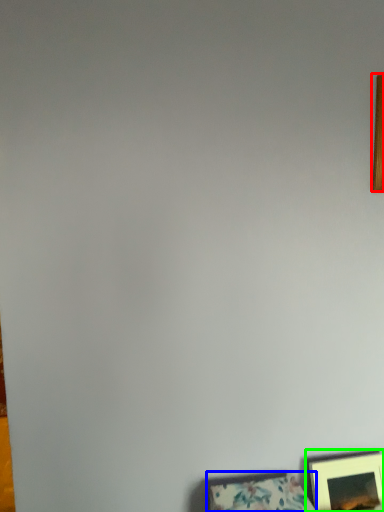
Question: Based on their relative distances, which object is nearer to picture frame (highlighted by a red box)? Choose from picture frame (highlighted by a blue box) and picture frame (highlighted by a green box).

Choices:
 (A) picture frame
 (B) picture frame

Answer: (B)